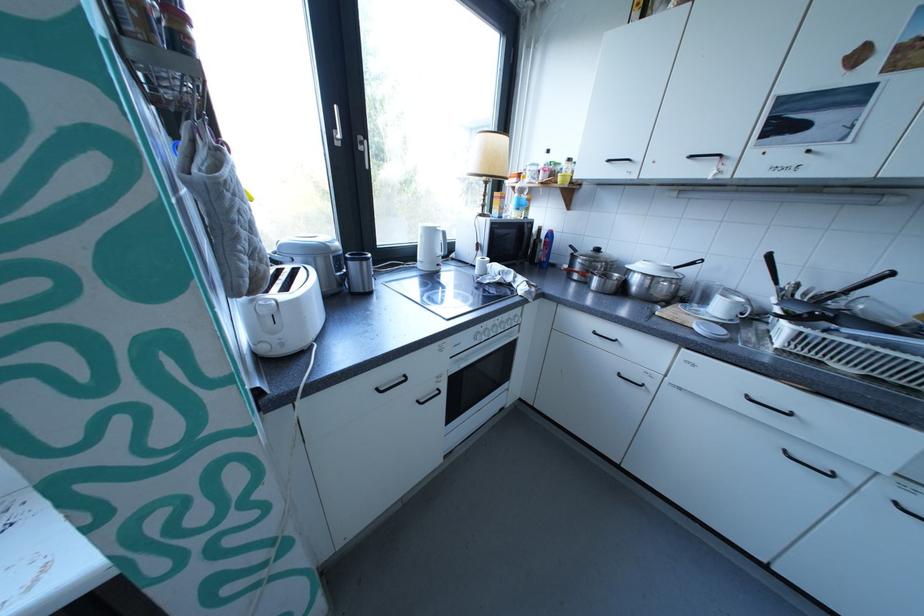
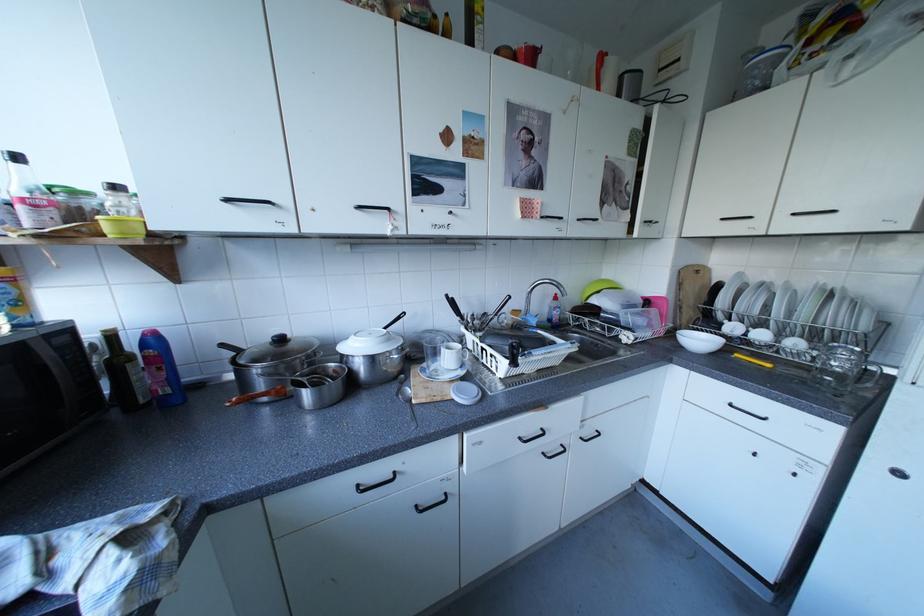
Find the pixel in the second image that matches point 622,161 in the first image.

(240, 200)